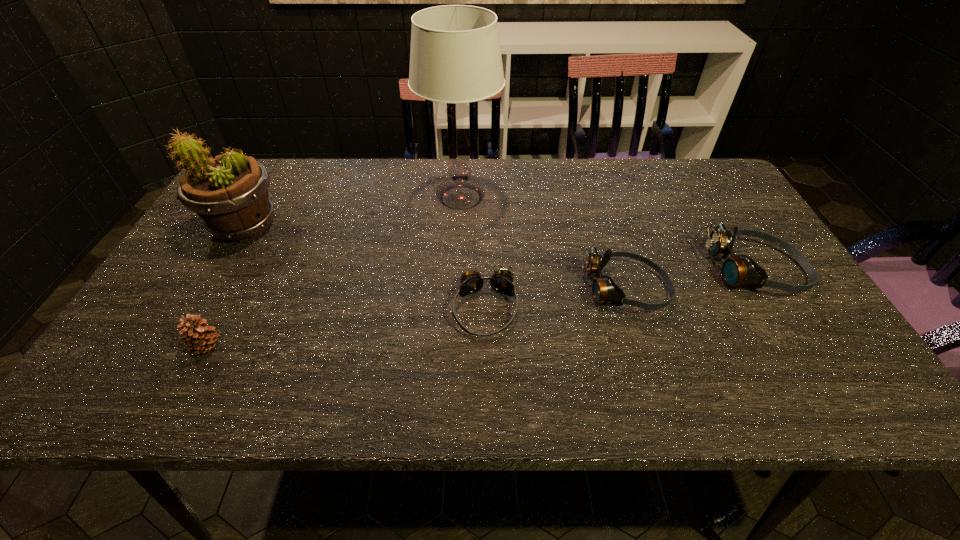
Identify the location of free point located on the front-facing side of the tallest object. (599, 198).

Image resolution: width=960 pixels, height=540 pixels. In order to click on vacant space positioned on the left of the pinecone in this screenshot , I will do `click(164, 346)`.

This screenshot has width=960, height=540. I want to click on flowerpot positioned at the far edge, so click(229, 193).

Find the location of a particular element. table lamp at the far edge is located at coordinates (455, 57).

Where is `goggles positioned at the near edge`? goggles positioned at the near edge is located at coordinates (501, 281).

At what (x,y) coordinates should I click in order to perform the action: click on pinecone located in the near edge section of the desktop. Please return your answer as a coordinate pair (x, y). This screenshot has height=540, width=960. Looking at the image, I should click on (199, 337).

At what (x,y) coordinates should I click in order to perform the action: click on flowerpot that is at the left edge. Please return your answer as a coordinate pair (x, y). Looking at the image, I should click on (229, 193).

The image size is (960, 540). Identify the location of pinecone that is at the left edge. (199, 337).

You are a GUI agent. You are given a task and a screenshot of the screen. Output one action in this format:
    pyautogui.click(x=<x>, y=<y>)
    Task: Click on the object located at the right edge
    
    Given the screenshot: What is the action you would take?
    pyautogui.click(x=740, y=270)

Image resolution: width=960 pixels, height=540 pixels. In order to click on object that is at the far left corner in this screenshot , I will do `click(229, 193)`.